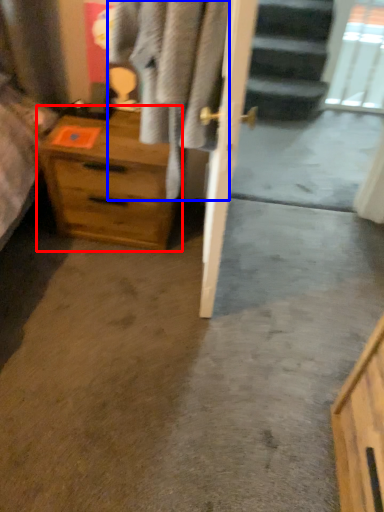
Question: Among these objects, which one is nearest to the camera, chest of drawers (highlighted by a red box) or clothing (highlighted by a blue box)?

Choices:
 (A) chest of drawers
 (B) clothing

Answer: (B)